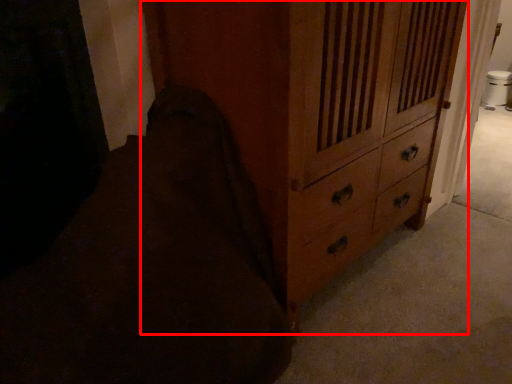
Question: Where is chest of drawers (annotated by the red box) located in relation to bedding in the image?

Choices:
 (A) right
 (B) left

Answer: (A)